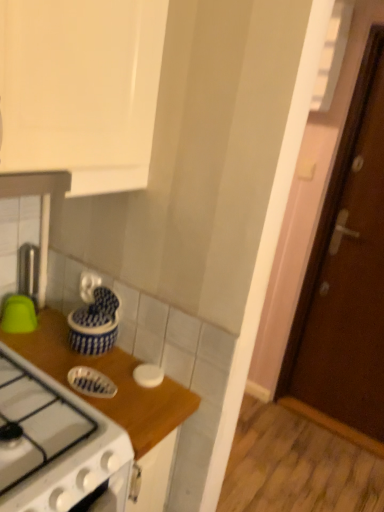
Find the location of a particular element. The height and width of the screenshot is (512, 384). vacant space that's between blue glossy jar at center, which ranks as the third kitchen appliance in right-to-left order, and green matte bowl at left, acting as the fourth kitchen appliance starting from the right is located at coordinates (52, 334).